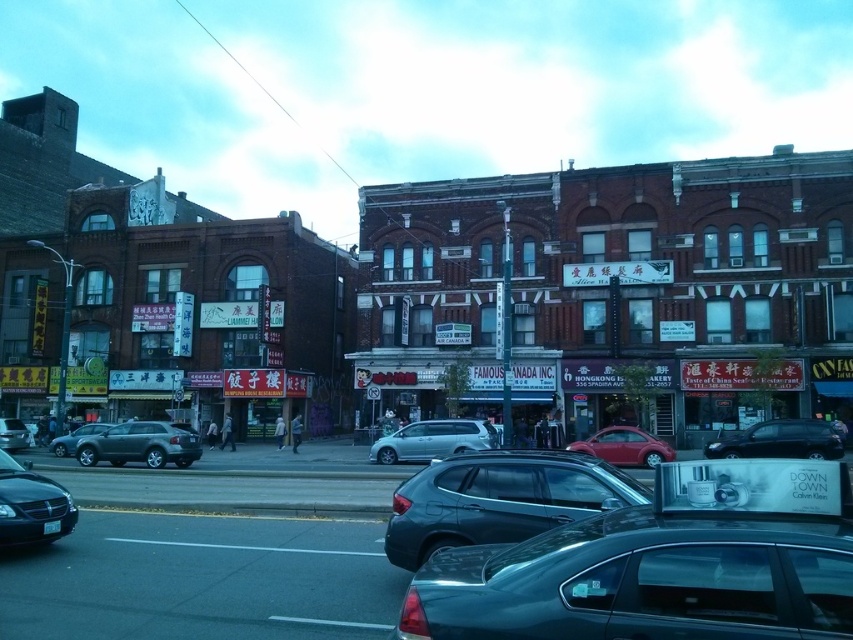
You are a pedestrian standing on the sidewalk looking down the street. You see a matte black sedan at lower left and a satin silver car at center. Which car is positioned higher up the street?

The matte black sedan at lower left is above the satin silver car at center, meaning it is positioned higher up the street.

You are a delivery driver who needs to enter a parking garage with a height restriction of 6 feet. You are currently driving a shiny black suv at center and a matte black car at center. Which vehicle should you choose to ensure it fits under the height restriction?

The matte black car at center has a lower height than the shiny black suv at center. Therefore, the matte black car at center is more likely to fit under the 6 feet height restriction.

You are a pedestrian trying to cross the street from the left side to the right side. There is a matte black sedan at lower left and a matte red car at center. Which car is closer to your starting position?

The matte black sedan at lower left is closer to your starting position because it is located at the lower left, which is near where you begin your crossing.